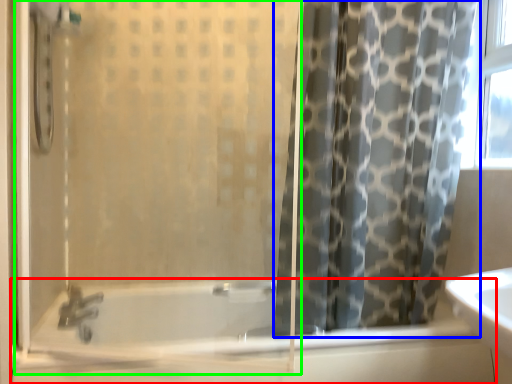
Question: Which object is the closest to the bathtub (highlighted by a red box)? Choose among these: curtain (highlighted by a blue box) or screen door (highlighted by a green box).

Choices:
 (A) curtain
 (B) screen door

Answer: (B)